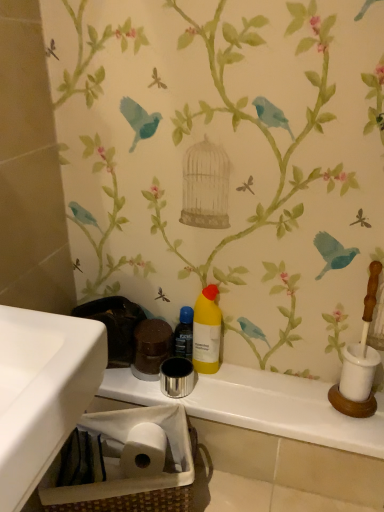
Question: Is woven brown basket at lower left inside or outside of yellow matte bottle at center?

Choices:
 (A) inside
 (B) outside

Answer: (B)

Question: Is point (94, 506) closer or farther from the camera than point (210, 373)?

Choices:
 (A) farther
 (B) closer

Answer: (B)

Question: Estimate the real-world distances between objects in this image. Which object is closer to the yellow matte bottle at center?

Choices:
 (A) woven brown basket at lower left
 (B) translucent plastic bottle at center
 (C) metallic silver cup at center

Answer: (B)

Question: Estimate the real-world distances between objects in this image. Which object is closer to the woven brown basket at lower left?

Choices:
 (A) translucent plastic bottle at center
 (B) metallic silver cup at center
 (C) yellow matte bottle at center

Answer: (B)